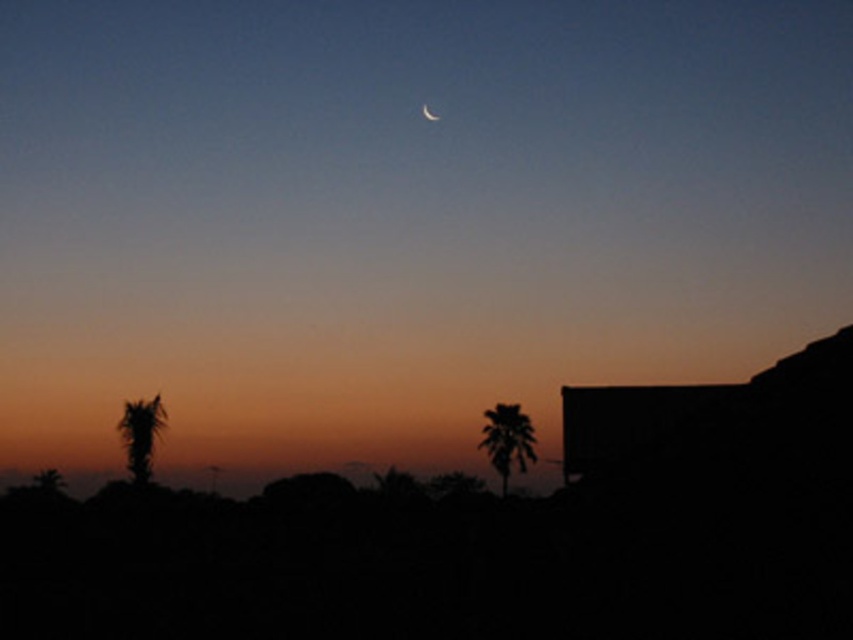
Question: Estimate the real-world distances between objects in this image. Which object is farther from the matte silver crescent at upper center?

Choices:
 (A) silhouette leafy palm at center
 (B) silhouette palm tree at lower left

Answer: (B)

Question: Based on their relative distances, which object is nearer to the matte silver crescent at upper center?

Choices:
 (A) silhouette leafy palm at center
 (B) silhouette palm tree at lower left

Answer: (A)

Question: In this image, where is silhouette leafy palm at center located relative to silhouette palm tree at lower left?

Choices:
 (A) above
 (B) below

Answer: (B)

Question: Can you confirm if silhouette leafy palm at center is positioned to the left of silhouette palm tree at lower left?

Choices:
 (A) no
 (B) yes

Answer: (A)

Question: Which point is farther to the camera?

Choices:
 (A) silhouette leafy palm at center
 (B) silhouette palm tree at lower left
 (C) matte silver crescent at upper center

Answer: (C)

Question: Can you confirm if silhouette palm tree at lower left is bigger than matte silver crescent at upper center?

Choices:
 (A) yes
 (B) no

Answer: (B)